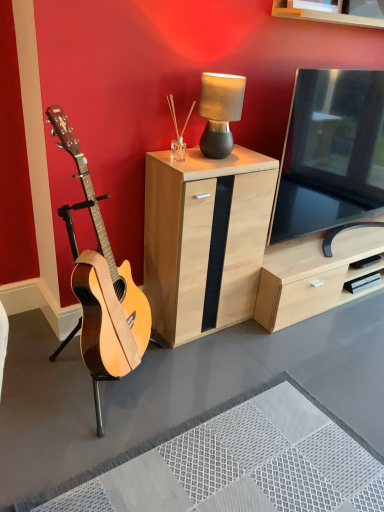
The height and width of the screenshot is (512, 384). What are the coordinates of `vacant space that is to the left of matte black lamp at upper center` in the screenshot? It's located at (186, 150).